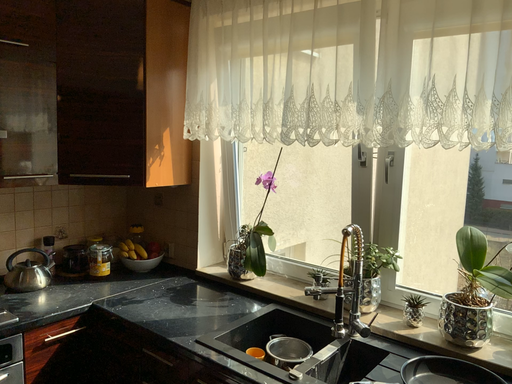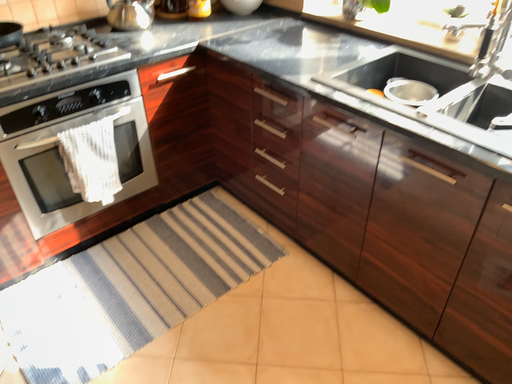
Question: How did the camera likely rotate when shooting the video?

Choices:
 (A) rotated upward
 (B) rotated downward

Answer: (B)